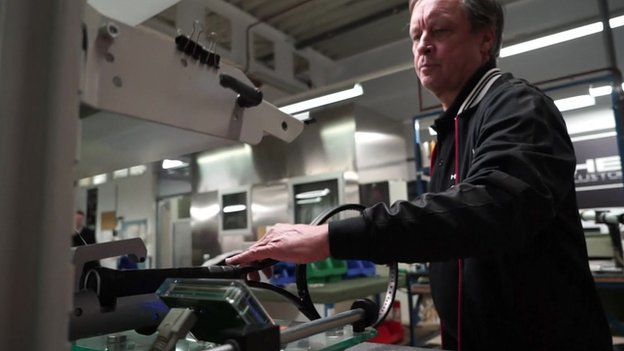
Find the location of a particular element. This screenshot has height=351, width=624. ceiling lights is located at coordinates (582, 99), (550, 38), (319, 103).